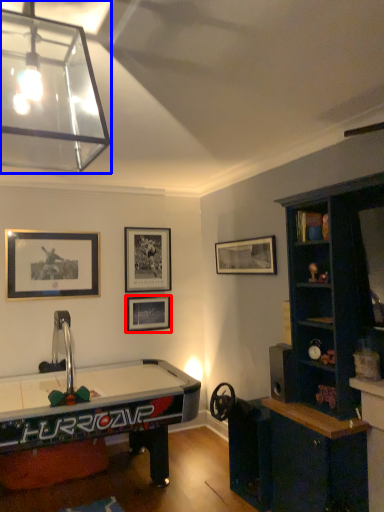
Question: Among these objects, which one is farthest to the camera, picture frame (highlighted by a red box) or lamp (highlighted by a blue box)?

Choices:
 (A) picture frame
 (B) lamp

Answer: (A)